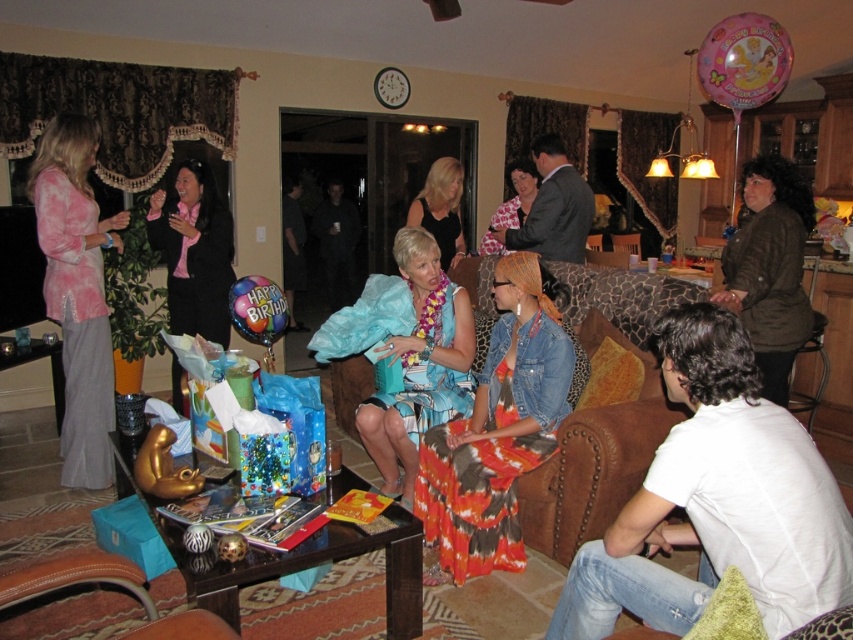
Question: Which point is farther to the camera?

Choices:
 (A) printed orange skirt at center
 (B) blue satin dress at center
 (C) leather couch at center

Answer: (B)

Question: Does brown leather armchair at lower left have a larger size compared to floral dress at center?

Choices:
 (A) yes
 (B) no

Answer: (B)

Question: Which of the following is the farthest from the observer?

Choices:
 (A) coord(440,218)
 (B) coord(453,449)
 (C) coord(776,282)

Answer: (A)

Question: Which point is closer to the camera?

Choices:
 (A) (485, 488)
 (B) (415, 429)
 (C) (752, 228)

Answer: (A)

Question: Considering the relative positions of pink tie-dye blouse at left and leather couch at center in the image provided, where is pink tie-dye blouse at left located with respect to leather couch at center?

Choices:
 (A) above
 (B) below

Answer: (A)

Question: Where is pink tie-dye blouse at left located in relation to floral dress at center in the image?

Choices:
 (A) above
 (B) below

Answer: (B)